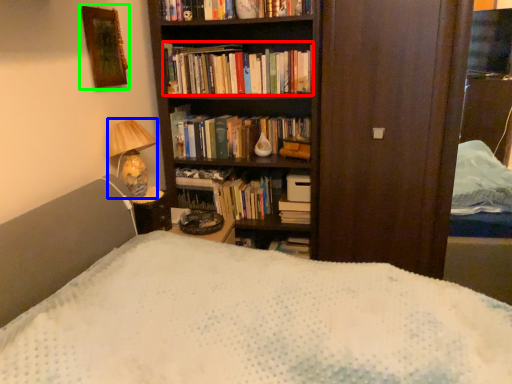
Question: Which is farther away from book (highlighted by a red box)? table lamp (highlighted by a blue box) or picture frame (highlighted by a green box)?

Choices:
 (A) table lamp
 (B) picture frame

Answer: (A)